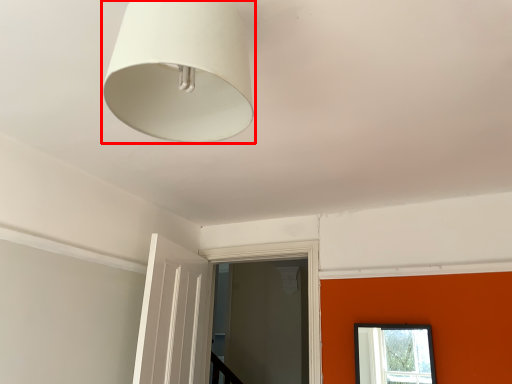
Question: Where is lamp (annotated by the red box) located in relation to window frame in the image?

Choices:
 (A) right
 (B) left

Answer: (B)